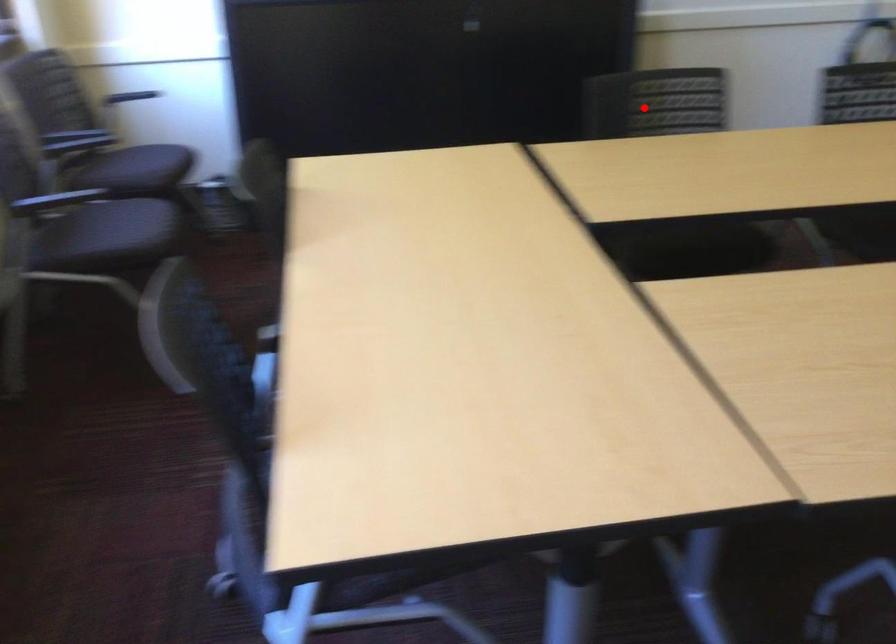
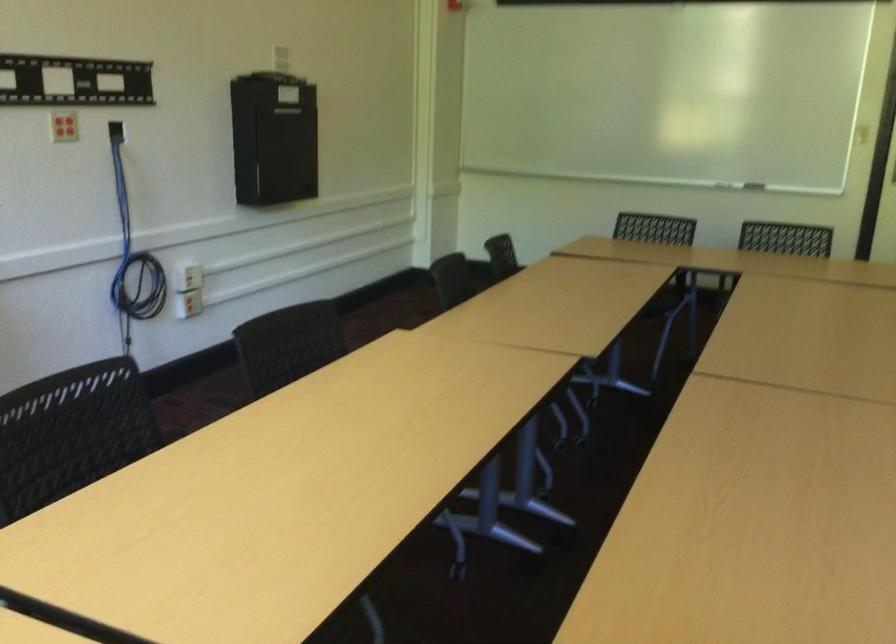
Find the pixel in the second image that matches the highlighted location in the first image.

(71, 433)